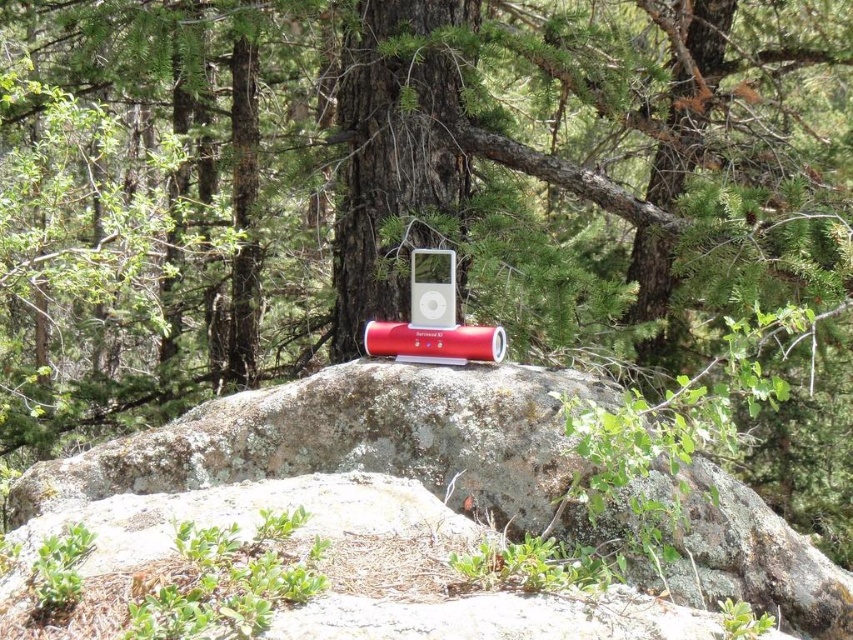
Question: Which point is farther to the camera?

Choices:
 (A) satin silver ipod at center
 (B) red matte speaker at center
 (C) gray rock at center

Answer: (A)

Question: Which of the following is the closest to the observer?

Choices:
 (A) (451, 278)
 (B) (381, 348)
 (C) (722, 486)

Answer: (C)

Question: Does red matte speaker at center appear on the right side of satin silver ipod at center?

Choices:
 (A) yes
 (B) no

Answer: (B)

Question: Is red matte speaker at center bigger than satin silver ipod at center?

Choices:
 (A) yes
 (B) no

Answer: (A)

Question: Which point is closer to the camera?

Choices:
 (A) gray rock at center
 (B) red matte speaker at center
 (C) satin silver ipod at center

Answer: (A)

Question: From the image, what is the correct spatial relationship of gray rock at center in relation to red matte speaker at center?

Choices:
 (A) right
 (B) left

Answer: (B)